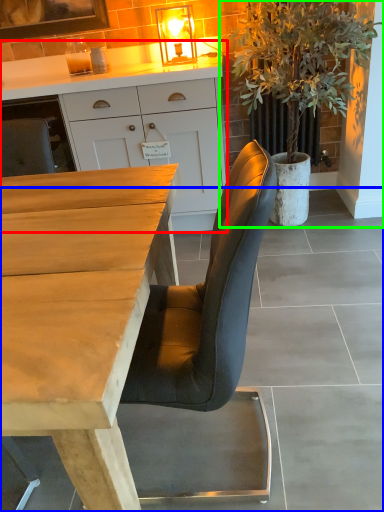
Question: Estimate the real-world distances between objects in this image. Which object is farther from cabinetry (highlighted by a red box), concrete (highlighted by a blue box) or houseplant (highlighted by a green box)?

Choices:
 (A) concrete
 (B) houseplant

Answer: (A)